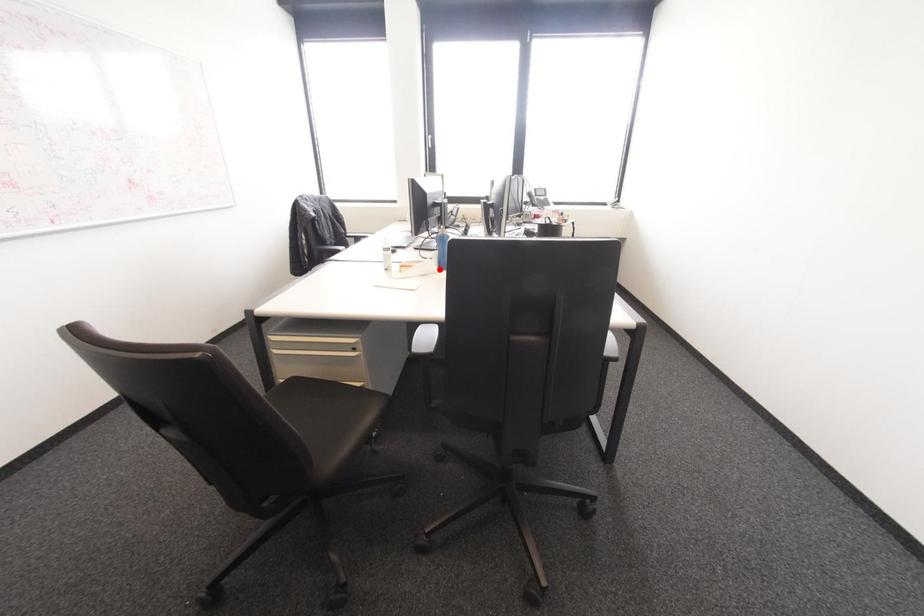
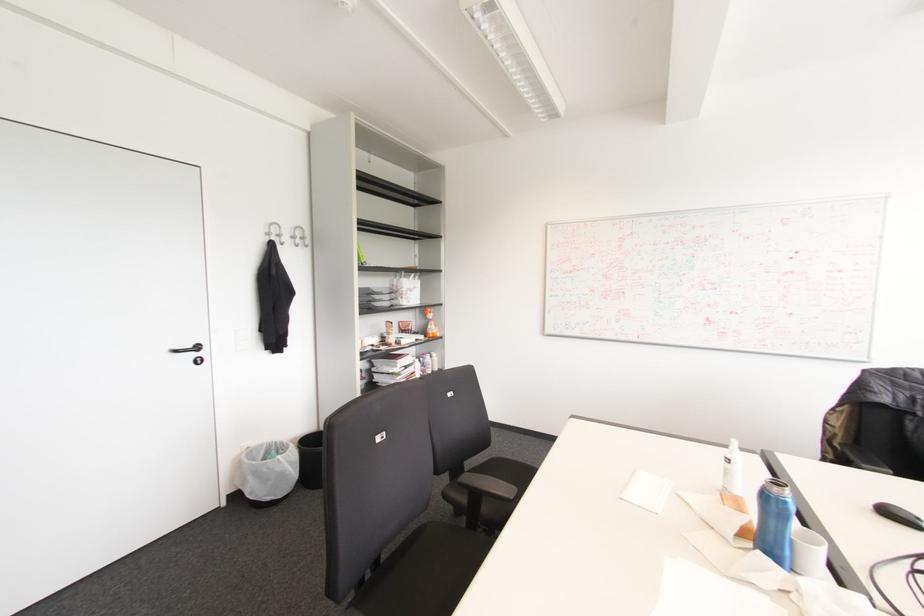
Question: I am providing you with two images of the same scene from different viewpoints. A red point is marked on the first image. Is the red point's position out of view in image 2?

Choices:
 (A) Yes
 (B) No

Answer: (A)